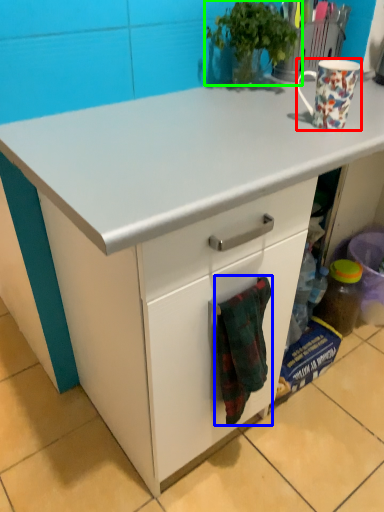
Question: Based on their relative distances, which object is nearer to coffee cup (highlighted by a red box)? Choose from blanket (highlighted by a blue box) and houseplant (highlighted by a green box).

Choices:
 (A) blanket
 (B) houseplant

Answer: (B)